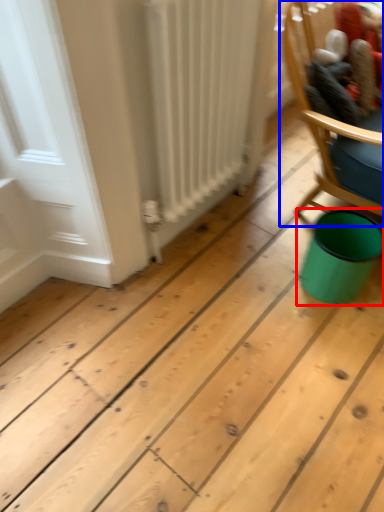
Question: Which object is further to the camera taking this photo, teal (highlighted by a red box) or chair (highlighted by a blue box)?

Choices:
 (A) teal
 (B) chair

Answer: (A)